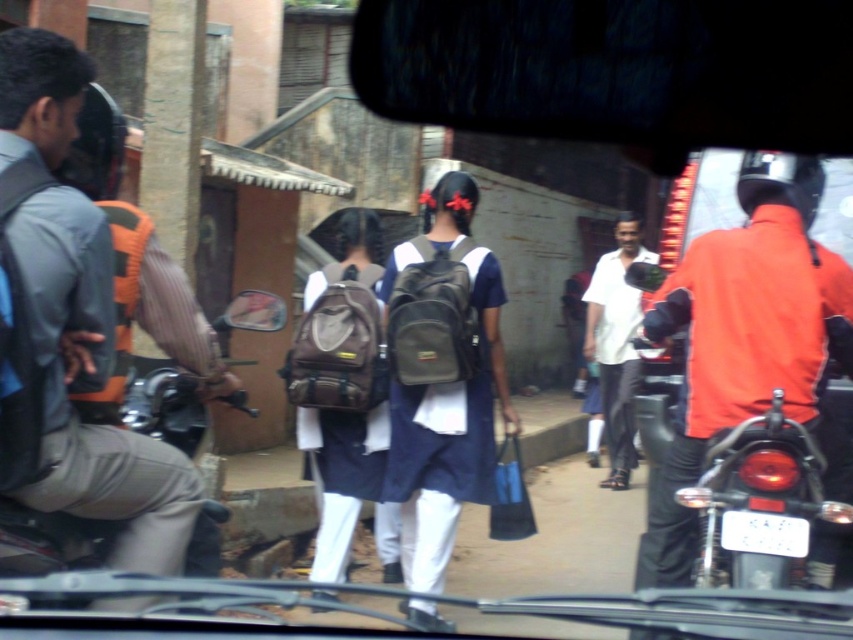
Question: Does matte gray backpack at center appear over matte black motorcycle at left?

Choices:
 (A) no
 (B) yes

Answer: (B)

Question: Which point is farther from the camera taking this photo?

Choices:
 (A) (183, 396)
 (B) (299, 333)

Answer: (B)

Question: Which point appears farthest from the camera in this image?

Choices:
 (A) (666, 545)
 (B) (228, 512)
 (C) (606, 429)
 (D) (488, 273)

Answer: (C)

Question: Does gray fabric backpack at left have a larger size compared to matte black motorcycle at left?

Choices:
 (A) no
 (B) yes

Answer: (B)

Question: Does matte gray backpack at center appear under brown fabric backpack at center?

Choices:
 (A) no
 (B) yes

Answer: (A)

Question: Which object appears farthest from the camera in this image?

Choices:
 (A) orange fabric helmet at right
 (B) matte black motorcycle at left
 (C) white matte shirt at center
 (D) brown fabric backpack at center

Answer: (C)